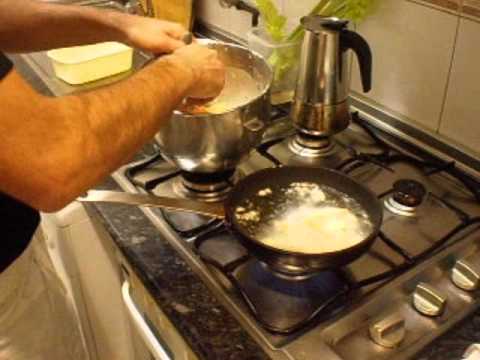
Identify the location of bowl. (72, 57).